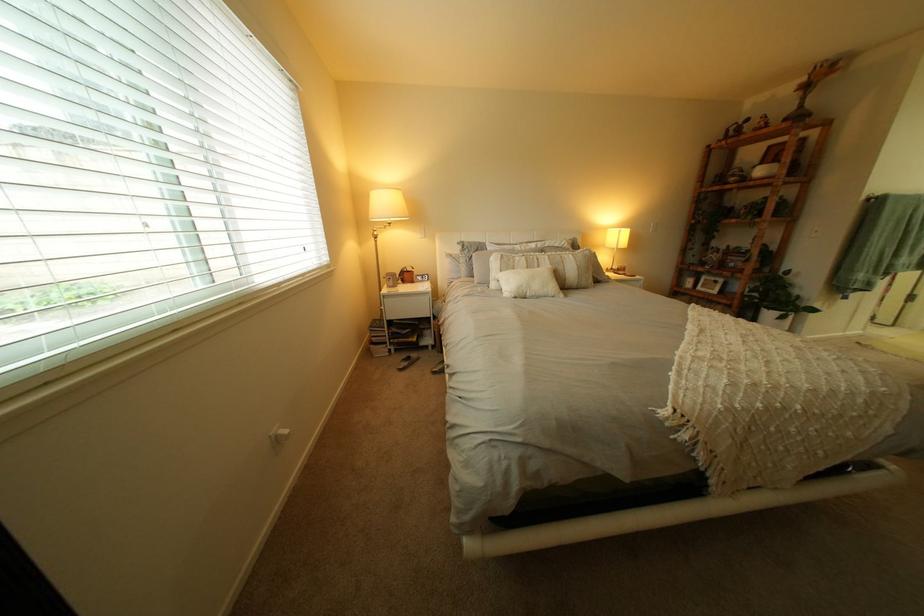
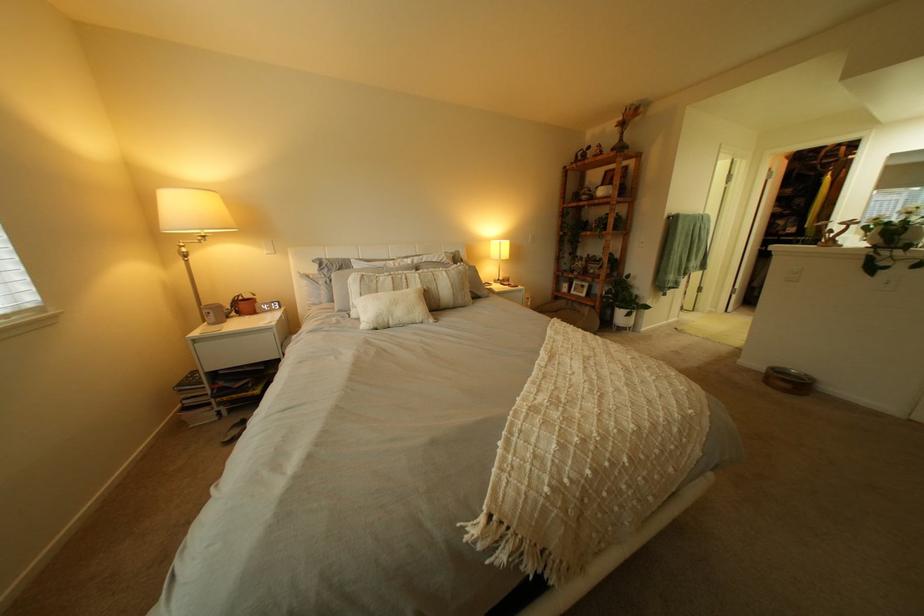
Where in the second image is the point corresponding to point (782, 305) from the first image?

(633, 305)